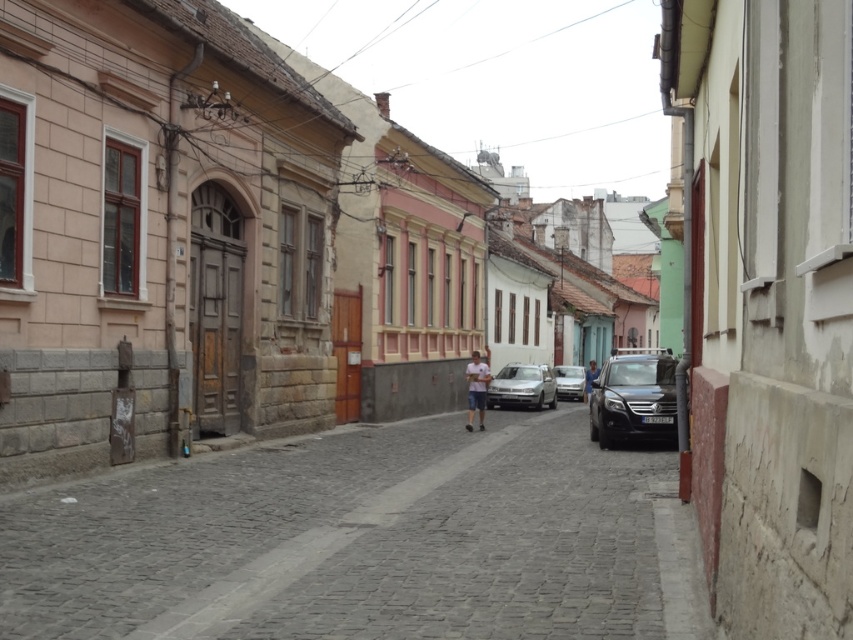
Is light blue denim shorts at center to the right of silver metallic sedan at center from the viewer's perspective?

No, light blue denim shorts at center is not to the right of silver metallic sedan at center.

Is light blue denim shorts at center to the left of silver metallic sedan at center from the viewer's perspective?

Yes, light blue denim shorts at center is to the left of silver metallic sedan at center.

Find the location of a particular element. This screenshot has height=640, width=853. light blue denim shorts at center is located at coordinates (476, 388).

Can you confirm if satin silver sedan at center is taller than matte blue shirt at center?

Correct, satin silver sedan at center is much taller as matte blue shirt at center.

Between satin silver sedan at center and matte blue shirt at center, which one appears on the left side from the viewer's perspective?

satin silver sedan at center is more to the left.

Where is `satin silver sedan at center`? satin silver sedan at center is located at coordinates (521, 387).

Based on the photo, is gray cobblestone street at center to the right of matte blue shirt at center from the viewer's perspective?

In fact, gray cobblestone street at center is to the left of matte blue shirt at center.

Does gray cobblestone street at center have a greater height compared to matte blue shirt at center?

In fact, gray cobblestone street at center may be shorter than matte blue shirt at center.

Is point (561, 440) farther from camera compared to point (583, 396)?

No, (561, 440) is closer to viewer.

The width and height of the screenshot is (853, 640). What are the coordinates of `gray cobblestone street at center` in the screenshot? It's located at click(x=347, y=541).